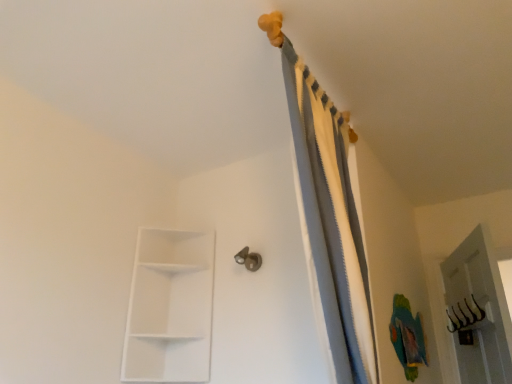
This screenshot has height=384, width=512. What do you see at coordinates (170, 308) in the screenshot?
I see `white matte/shelf at lower left` at bounding box center [170, 308].

At what (x,y) coordinates should I click in order to perform the action: click on gray fabric curtain at upper center. Please return your answer as a coordinate pair (x, y). This screenshot has width=512, height=384. Looking at the image, I should click on (331, 223).

Identify the location of white matte/shelf at lower left. Image resolution: width=512 pixels, height=384 pixels. (170, 308).

Is point (246, 268) farther from viewer compared to point (128, 358)?

Yes, point (246, 268) is behind point (128, 358).

Is metallic silver door handle at center spatially inside white matte/shelf at lower left, or outside of it?

metallic silver door handle at center lies outside white matte/shelf at lower left.

Considering the relative positions of metallic silver door handle at center and white matte/shelf at lower left in the image provided, is metallic silver door handle at center behind white matte/shelf at lower left?

Yes, metallic silver door handle at center is behind white matte/shelf at lower left.

From a real-world perspective, does metallic silver door handle at center stand above white matte/shelf at lower left?

Yes, from a real-world perspective, metallic silver door handle at center is above white matte/shelf at lower left.

Between point (261, 263) and point (362, 267), which one is positioned in front?

The point (362, 267) is more forward.

Looking at this image, is the depth of metallic silver door handle at center less than that of gray fabric curtain at upper center?

No, it is not.

Between metallic silver door handle at center and gray fabric curtain at upper center, which one has larger size?

Bigger between the two is gray fabric curtain at upper center.

In the scene shown: Is metallic silver door handle at center shorter than gray fabric curtain at upper center?

Indeed, metallic silver door handle at center has a lesser height compared to gray fabric curtain at upper center.

Do you think white matte/shelf at lower left is within gray fabric curtain at upper center, or outside of it?

white matte/shelf at lower left is outside gray fabric curtain at upper center.

From the picture: Does white matte/shelf at lower left touch gray fabric curtain at upper center?

white matte/shelf at lower left and gray fabric curtain at upper center are clearly separated.

How different are the orientations of white matte/shelf at lower left and gray fabric curtain at upper center in degrees?

The facing directions of white matte/shelf at lower left and gray fabric curtain at upper center are 90 degrees apart.

Who is shorter, white matte/shelf at lower left or gray fabric curtain at upper center?

With less height is white matte/shelf at lower left.

Which of these two, gray fabric curtain at upper center or white matte/shelf at lower left, is thinner?

Thinner between the two is gray fabric curtain at upper center.

Who is shorter, gray fabric curtain at upper center or white matte/shelf at lower left?

With less height is white matte/shelf at lower left.

Is gray fabric curtain at upper center far from white matte/shelf at lower left?

No, gray fabric curtain at upper center is not far from white matte/shelf at lower left.

Is white matte/shelf at lower left directly adjacent to metallic silver door handle at center?

No.

Does white matte/shelf at lower left appear on the left side of metallic silver door handle at center?

Indeed, white matte/shelf at lower left is positioned on the left side of metallic silver door handle at center.

Looking at this image, which is more distant, (x=128, y=312) or (x=234, y=257)?

The point (x=234, y=257) is farther from the camera.

In the image, there is a metallic silver door handle at center. Where is `shelf below it (from a real-world perspective)`? This screenshot has width=512, height=384. shelf below it (from a real-world perspective) is located at coordinates (170, 308).

How different are the orientations of gray fabric curtain at upper center and metallic silver door handle at center in degrees?

gray fabric curtain at upper center and metallic silver door handle at center are facing 90 degrees away from each other.

Who is shorter, gray fabric curtain at upper center or metallic silver door handle at center?

metallic silver door handle at center.

In terms of size, does gray fabric curtain at upper center appear bigger or smaller than metallic silver door handle at center?

In the image, gray fabric curtain at upper center appears to be larger than metallic silver door handle at center.

Where is `door handle that appears behind the white matte/shelf at lower left`? The height and width of the screenshot is (384, 512). door handle that appears behind the white matte/shelf at lower left is located at coordinates (249, 259).

Where is `door handle on the left side of gray fabric curtain at upper center`? The width and height of the screenshot is (512, 384). door handle on the left side of gray fabric curtain at upper center is located at coordinates (249, 259).

Based on the photo, based on their spatial positions, is metallic silver door handle at center or gray fabric curtain at upper center closer to white matte/shelf at lower left?

Among the two, metallic silver door handle at center is located nearer to white matte/shelf at lower left.

Which object lies nearer to the anchor point metallic silver door handle at center, white matte/shelf at lower left or gray fabric curtain at upper center?

white matte/shelf at lower left is positioned closer to the anchor metallic silver door handle at center.

Which object lies further to the anchor point gray fabric curtain at upper center, metallic silver door handle at center or white matte/shelf at lower left?

white matte/shelf at lower left.

Which object lies nearer to the anchor point metallic silver door handle at center, gray fabric curtain at upper center or white matte/shelf at lower left?

Based on the image, white matte/shelf at lower left appears to be nearer to metallic silver door handle at center.

Looking at the image, which one is located further to white matte/shelf at lower left, gray fabric curtain at upper center or metallic silver door handle at center?

gray fabric curtain at upper center.

Estimate the real-world distances between objects in this image. Which object is closer to gray fabric curtain at upper center, white matte/shelf at lower left or metallic silver door handle at center?

Among the two, metallic silver door handle at center is located nearer to gray fabric curtain at upper center.

At what (x,y) coordinates should I click in order to perform the action: click on shelf between gray fabric curtain at upper center and metallic silver door handle at center along the z-axis. Please return your answer as a coordinate pair (x, y). The width and height of the screenshot is (512, 384). Looking at the image, I should click on (170, 308).